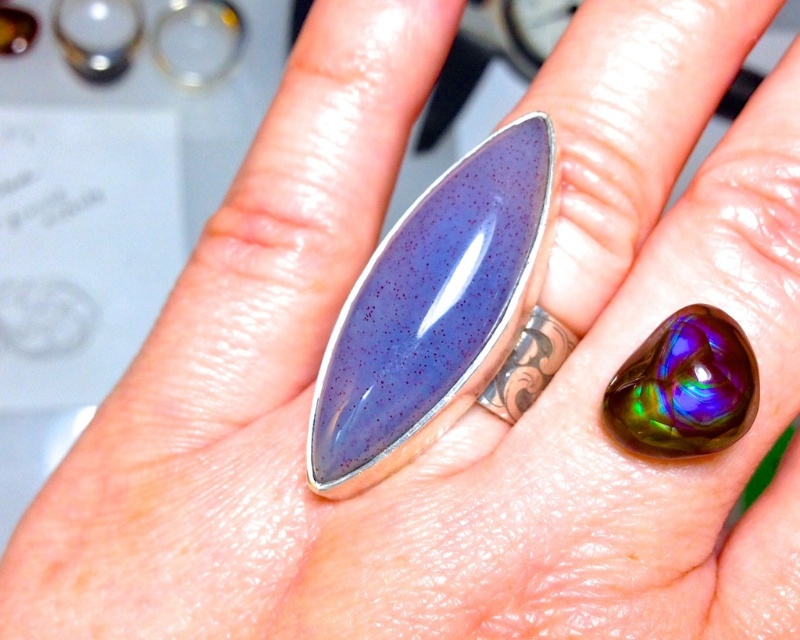
Question: Observing the image, what is the correct spatial positioning of purple glossy ring at center in reference to iridescent gemstone at center?

Choices:
 (A) below
 (B) above

Answer: (B)

Question: Which point is closer to the camera?

Choices:
 (A) purple glossy ring at center
 (B) iridescent gemstone at center

Answer: (B)

Question: Is purple glossy ring at center below iridescent gemstone at center?

Choices:
 (A) yes
 (B) no

Answer: (B)

Question: Which of the following is the closest to the observer?

Choices:
 (A) purple glossy ring at center
 (B) iridescent gemstone at center

Answer: (B)

Question: Which of the following is the closest to the observer?

Choices:
 (A) iridescent gemstone at center
 (B) purple glossy ring at center

Answer: (A)

Question: Is purple glossy ring at center positioned before iridescent gemstone at center?

Choices:
 (A) yes
 (B) no

Answer: (B)